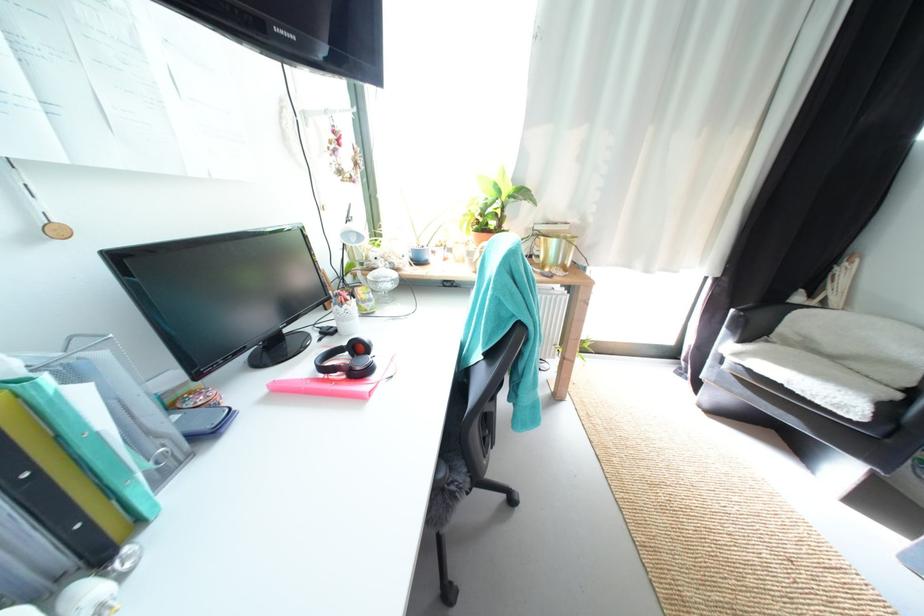
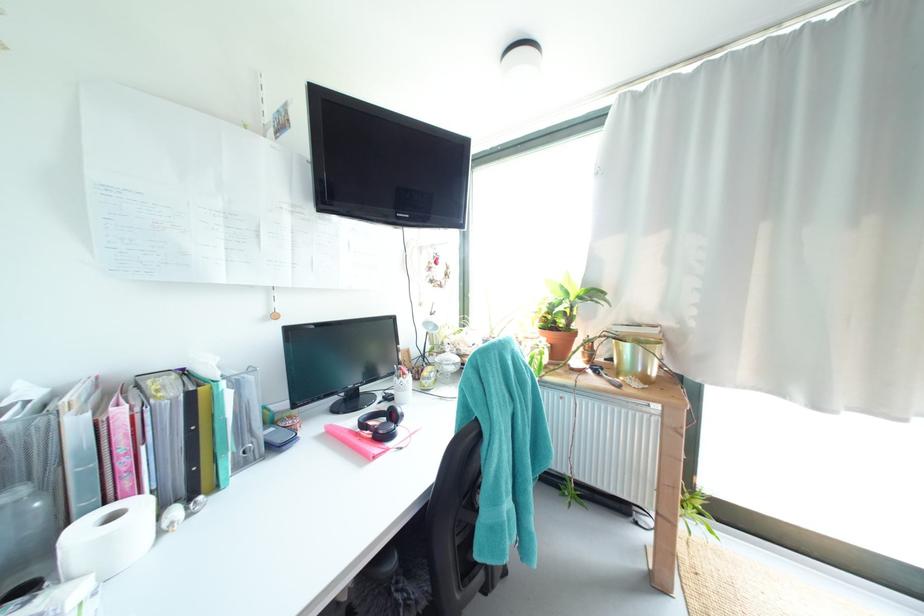
Locate, in the second image, the point that corresponds to point (505, 216) in the first image.

(573, 315)